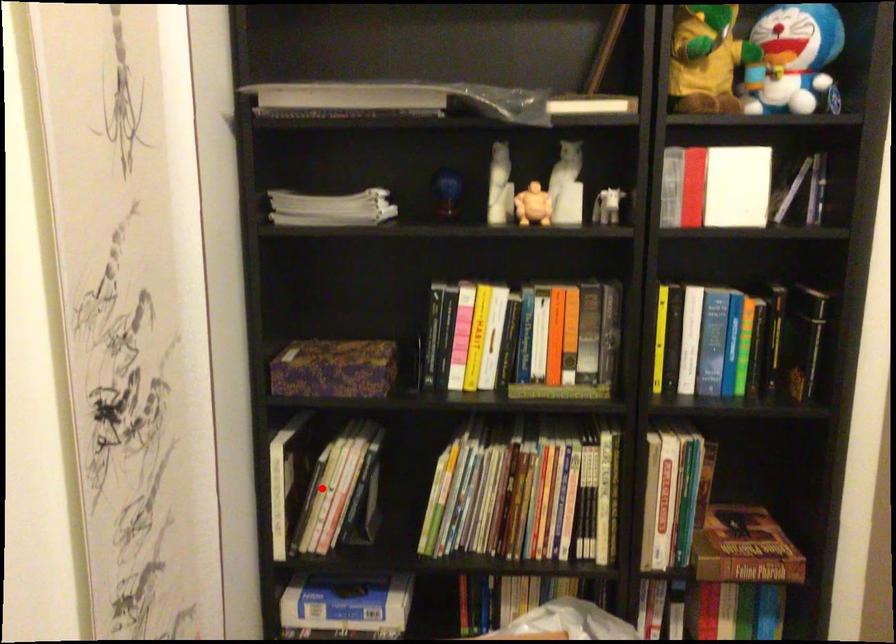
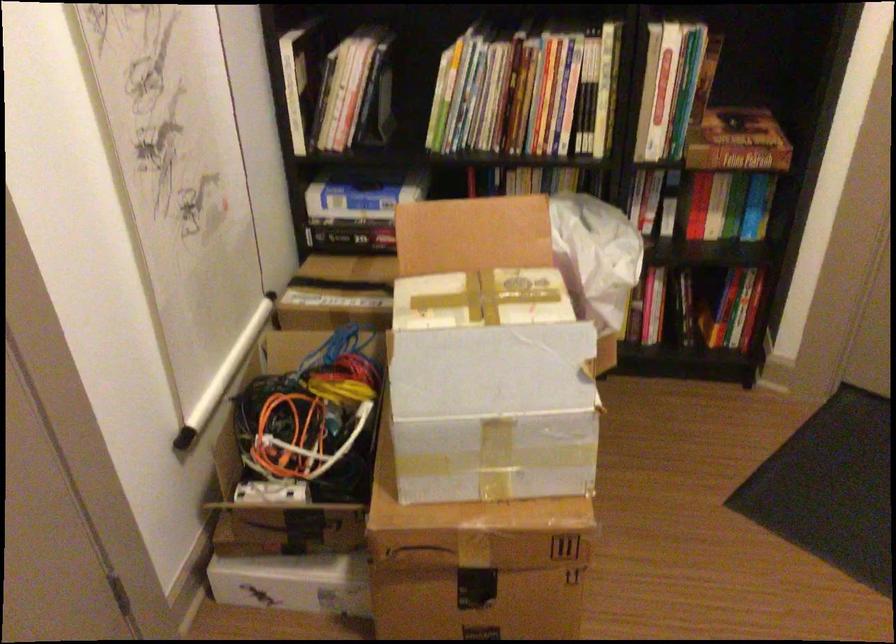
Question: I am providing you with two images of the same scene from different viewpoints. A red point is marked on the first image. Is the red point's position out of view in image 2?

Choices:
 (A) Yes
 (B) No

Answer: (B)